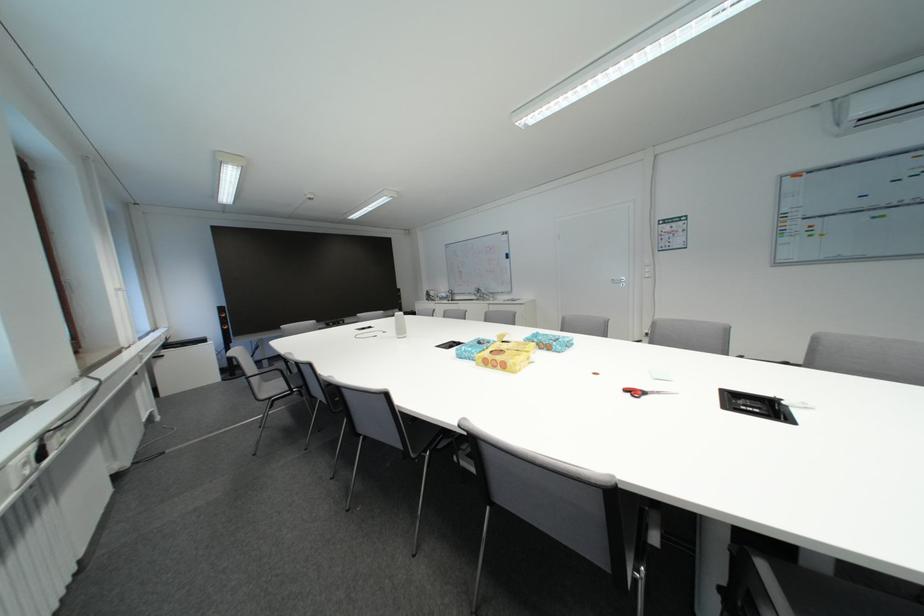
The location [479,265] corresponds to which object?

This point indicates the blue whiteboard marker.